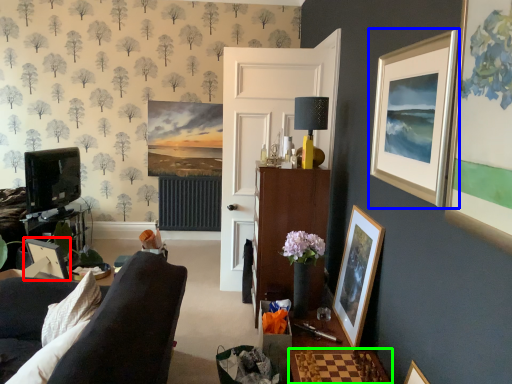
Question: Which object is the closest to the picture frame (highlighted by a red box)? Choose among these: picture frame (highlighted by a blue box) or table (highlighted by a green box).

Choices:
 (A) picture frame
 (B) table

Answer: (B)